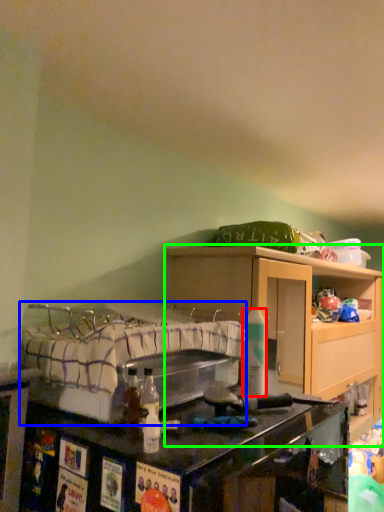
Question: Based on their relative distances, which object is farther from bottle (highlighted by a red box)? Choose from bed (highlighted by a blue box) and cabinetry (highlighted by a green box).

Choices:
 (A) bed
 (B) cabinetry

Answer: (B)